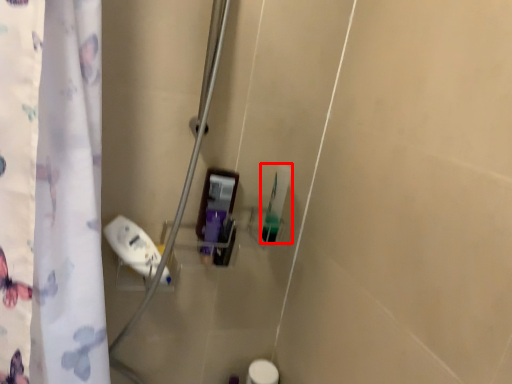
Question: Where is toiletry (annotated by the red box) located in relation to toiletry in the image?

Choices:
 (A) left
 (B) right

Answer: (B)